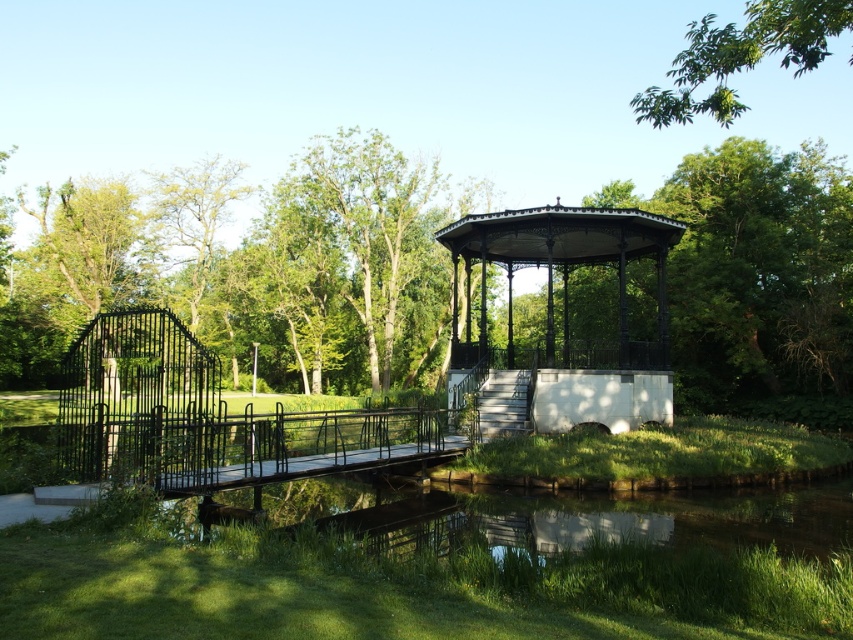
You are standing on the paved pathway near the bridge and want to take a photo of the black wrought iron gazebo at center. However, there is a green leafy tree at upper center in the way. Can you see the gazebo clearly through the tree?

The green leafy tree at upper center is located above the black wrought iron gazebo at center, so the tree is blocking the view of the gazebo. You will not be able to see the gazebo clearly through the tree.

You are standing at the entrance of the park and see two points in the scene. The first point is located at coordinates point (357,259), and the second point is at point (677,122). Which point is closer to you?

Point (357,259) is further to the viewer than point (677,122), so the point closer to you is point (677,122).

You are planning to set up a picnic blanket in the park. The picnic blanket is 3 meters wide. You see the black wrought iron gazebo at center and the green leafy tree at upper right. Can the picnic blanket fit between them without touching either?

The black wrought iron gazebo at center is narrower than the green leafy tree at upper right. However, the exact distance between them isn